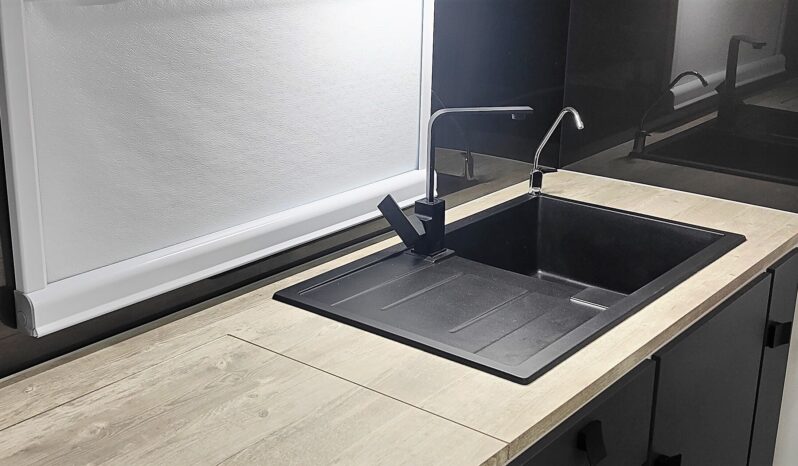
Find any where you'd turn on the faucet in the picture. Your answer should be formatted as a list of tuples, i.e. [(x1, y1), (x2, y2), ...], where each tuple contains the x and y coordinates of a point satisfying the conditions above.

[(401, 225)]